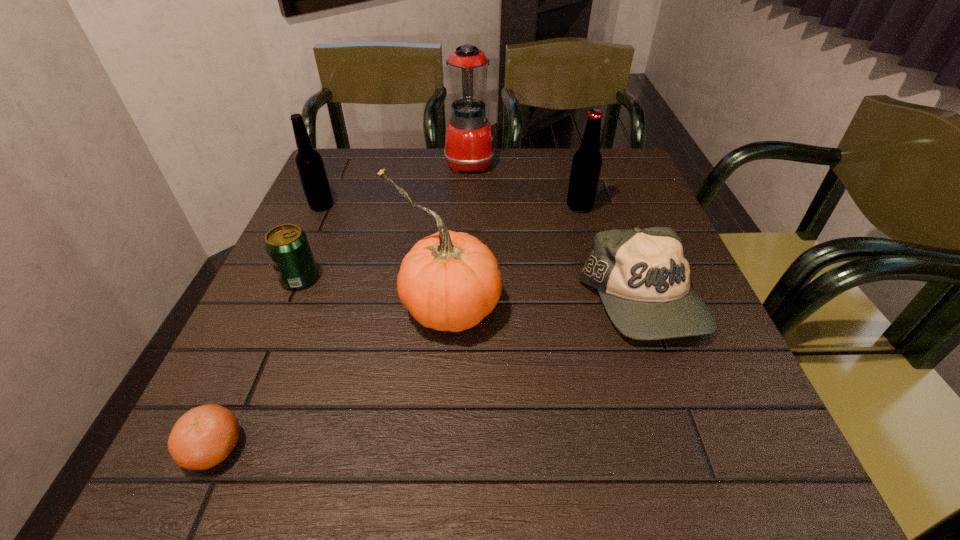
Find the location of a particular element. This screenshot has height=540, width=960. beer bottle located at the right edge is located at coordinates (587, 161).

You are a GUI agent. You are given a task and a screenshot of the screen. Output one action in this format:
    pyautogui.click(x=<x>, y=<y>)
    Task: Click on the baseball cap positioned at the right edge
    This screenshot has height=540, width=960.
    Given the screenshot: What is the action you would take?
    pyautogui.click(x=643, y=278)

This screenshot has height=540, width=960. In order to click on object that is at the near left corner in this screenshot , I will do `click(204, 436)`.

Locate an element on the screen. The image size is (960, 540). blank space at the near edge of the desktop is located at coordinates (648, 439).

In the image, there is a desktop. At what (x,y) coordinates should I click in order to perform the action: click on vacant space at the left edge. Please return your answer as a coordinate pair (x, y). Looking at the image, I should click on (358, 204).

Where is `vacant space at the right edge`? This screenshot has height=540, width=960. vacant space at the right edge is located at coordinates (730, 389).

Locate an element on the screen. Image resolution: width=960 pixels, height=540 pixels. free space at the near left corner of the desktop is located at coordinates (279, 446).

Image resolution: width=960 pixels, height=540 pixels. I want to click on vacant area at the far right corner of the desktop, so click(627, 159).

At what (x,y) coordinates should I click in order to perform the action: click on free space that is in between the nearest object and the pumpkin. Please return your answer as a coordinate pair (x, y). Looking at the image, I should click on (331, 377).

Locate an element on the screen. The width and height of the screenshot is (960, 540). vacant point located between the pumpkin and the beer can is located at coordinates (374, 292).